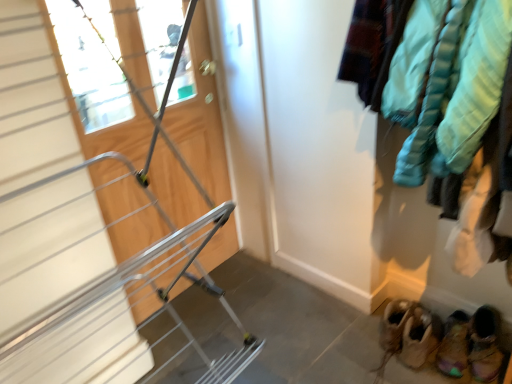
Question: Should I look upward or downward to see brown suede moccasins at lower right, the third footwear in the right-to-left sequence?

Choices:
 (A) down
 (B) up

Answer: (A)

Question: Does brown suede moccasins at lower right, the third footwear in the right-to-left sequence, touch teal puffer jacket at right?

Choices:
 (A) no
 (B) yes

Answer: (A)

Question: Does brown suede moccasins at lower right, the 1th footwear in the left-to-right sequence, turn towards teal puffer jacket at right?

Choices:
 (A) yes
 (B) no

Answer: (B)

Question: Considering the relative sizes of brown suede moccasins at lower right, the 1th footwear in the left-to-right sequence, and teal puffer jacket at right in the image provided, is brown suede moccasins at lower right, the 1th footwear in the left-to-right sequence, taller than teal puffer jacket at right?

Choices:
 (A) yes
 (B) no

Answer: (B)

Question: Is brown suede moccasins at lower right, the 1th footwear in the left-to-right sequence, far from teal puffer jacket at right?

Choices:
 (A) no
 (B) yes

Answer: (A)

Question: Is brown suede moccasins at lower right, the 1th footwear in the left-to-right sequence, located outside teal puffer jacket at right?

Choices:
 (A) yes
 (B) no

Answer: (A)

Question: Is brown suede moccasins at lower right, the third footwear in the right-to-left sequence, oriented away from teal puffer jacket at right?

Choices:
 (A) yes
 (B) no

Answer: (B)

Question: Is leather suede booties at lower right, the 2th footwear in the right-to-left sequence, wider than brown suede moccasins at lower right, the 1th footwear in the left-to-right sequence?

Choices:
 (A) yes
 (B) no

Answer: (B)

Question: From the image's perspective, is leather suede booties at lower right, the second footwear from the left, on top of brown suede moccasins at lower right, the 1th footwear in the left-to-right sequence?

Choices:
 (A) no
 (B) yes

Answer: (A)

Question: Is leather suede booties at lower right, the 2th footwear in the right-to-left sequence, oriented towards brown suede moccasins at lower right, the 1th footwear in the left-to-right sequence?

Choices:
 (A) yes
 (B) no

Answer: (B)

Question: Considering the relative sizes of leather suede booties at lower right, the 2th footwear in the right-to-left sequence, and brown suede moccasins at lower right, the third footwear in the right-to-left sequence, in the image provided, is leather suede booties at lower right, the 2th footwear in the right-to-left sequence, smaller than brown suede moccasins at lower right, the third footwear in the right-to-left sequence,?

Choices:
 (A) no
 (B) yes

Answer: (B)

Question: Is leather suede booties at lower right, the 2th footwear in the right-to-left sequence, in front of brown suede moccasins at lower right, the 1th footwear in the left-to-right sequence?

Choices:
 (A) yes
 (B) no

Answer: (A)

Question: Would you say leather suede booties at lower right, the second footwear from the left, contains brown suede moccasins at lower right, the third footwear in the right-to-left sequence?

Choices:
 (A) yes
 (B) no

Answer: (B)

Question: Is wooden door at center touching multicolored suede booties at lower right, placed as the 3th footwear when sorted from left to right?

Choices:
 (A) no
 (B) yes

Answer: (A)